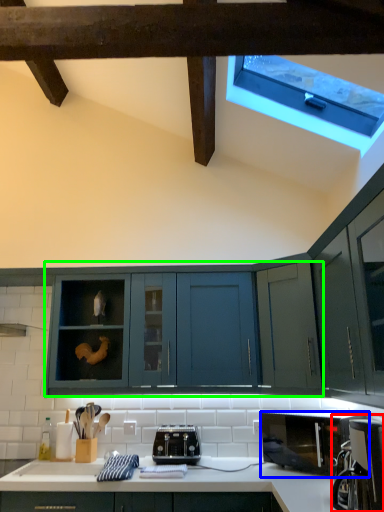
Question: Estimate the real-world distances between objects in this image. Which object is closer to coffee machine (highlighted by a red box), microwave oven (highlighted by a blue box) or cabinetry (highlighted by a green box)?

Choices:
 (A) microwave oven
 (B) cabinetry

Answer: (A)